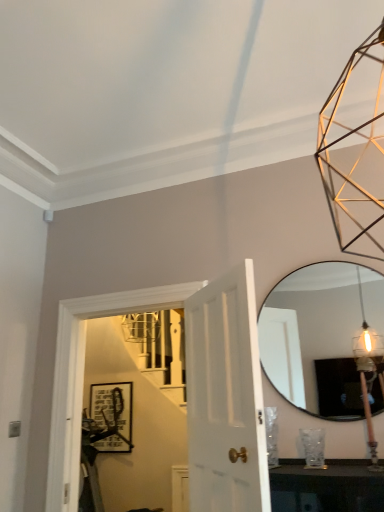
This screenshot has height=512, width=384. What do you see at coordinates (111, 416) in the screenshot? I see `black matte picture frame at center` at bounding box center [111, 416].

The width and height of the screenshot is (384, 512). What are the coordinates of `black matte picture frame at center` in the screenshot? It's located at (111, 416).

Is white glossy door at center to the right of wooden pole at right from the viewer's perspective?

Incorrect, white glossy door at center is not on the right side of wooden pole at right.

Can you confirm if white glossy door at center is taller than wooden pole at right?

Yes, white glossy door at center is taller than wooden pole at right.

Is white glossy door at center with wooden pole at right?

No, white glossy door at center is not in contact with wooden pole at right.

Considering the sizes of objects white glossy door at center and wooden pole at right in the image provided, who is smaller, white glossy door at center or wooden pole at right?

wooden pole at right.

From the image's perspective, between black matte picture frame at center and matte glass mirror at right, which one is located above?

matte glass mirror at right is shown above in the image.

Can you confirm if black matte picture frame at center is taller than matte glass mirror at right?

In fact, black matte picture frame at center may be shorter than matte glass mirror at right.

Measure the distance from black matte picture frame at center to matte glass mirror at right.

black matte picture frame at center is 2.14 meters away from matte glass mirror at right.

Is matte glass mirror at right beside black matte picture frame at center?

matte glass mirror at right and black matte picture frame at center are not in contact.

Considering the points (362, 277) and (127, 401), which point is in front, point (362, 277) or point (127, 401)?

Positioned in front is point (362, 277).

Which object is more forward, matte glass mirror at right or black matte picture frame at center?

matte glass mirror at right is closer to the camera.

Looking at this image, is black matte picture frame at center directly adjacent to wooden pole at right?

black matte picture frame at center and wooden pole at right are clearly separated.

Can you confirm if black matte picture frame at center is positioned to the left of wooden pole at right?

Yes.

Is black matte picture frame at center looking in the opposite direction of wooden pole at right?

No, wooden pole at right is not at the back of black matte picture frame at center.

From the image's perspective, which one is positioned higher, black matte picture frame at center or wooden pole at right?

From the image's view, wooden pole at right is above.

Looking at this image, can you confirm if wooden pole at right is thinner than white glossy door at center?

Yes, wooden pole at right is thinner than white glossy door at center.

Is the depth of wooden pole at right less than that of white glossy door at center?

That is False.

Which object is positioned more to the left, wooden pole at right or white glossy door at center?

Positioned to the left is white glossy door at center.

Is matte glass mirror at right facing away from wooden pole at right?

matte glass mirror at right is not turned away from wooden pole at right.

Which is more to the right, matte glass mirror at right or wooden pole at right?

Positioned to the right is wooden pole at right.

From a real-world perspective, between matte glass mirror at right and wooden pole at right, who is vertically lower?

In real-world perspective, wooden pole at right is lower.

Which is more to the left, white glossy door at center or black matte picture frame at center?

Positioned to the left is black matte picture frame at center.

Identify the location of picture frame lying behind the white glossy door at center. (111, 416).

Considering their positions, is white glossy door at center located in front of or behind black matte picture frame at center?

Visually, white glossy door at center is located in front of black matte picture frame at center.

Is white glossy door at center outside of black matte picture frame at center?

Yes, white glossy door at center is outside of black matte picture frame at center.

I want to click on door in front of the wooden pole at right, so click(x=225, y=397).

This screenshot has height=512, width=384. Find the location of `picture frame on the left side of matte glass mirror at right`. picture frame on the left side of matte glass mirror at right is located at coordinates (111, 416).

Estimate the real-world distances between objects in this image. Which object is further from wooden pole at right, black matte picture frame at center or white glossy door at center?

Among the two, black matte picture frame at center is located further to wooden pole at right.

Which object lies nearer to the anchor point wooden pole at right, matte glass mirror at right or white glossy door at center?

Based on the image, matte glass mirror at right appears to be nearer to wooden pole at right.

Estimate the real-world distances between objects in this image. Which object is further from wooden pole at right, matte glass mirror at right or black matte picture frame at center?

black matte picture frame at center.

Estimate the real-world distances between objects in this image. Which object is closer to black matte picture frame at center, white glossy door at center or wooden pole at right?

The object closer to black matte picture frame at center is wooden pole at right.

Looking at the image, which one is located closer to black matte picture frame at center, white glossy door at center or matte glass mirror at right?

matte glass mirror at right lies closer to black matte picture frame at center than the other object.

Looking at the image, which one is located closer to white glossy door at center, black matte picture frame at center or wooden pole at right?

→ Among the two, wooden pole at right is located nearer to white glossy door at center.

Looking at the image, which one is located further to wooden pole at right, white glossy door at center or matte glass mirror at right?

white glossy door at center is further to wooden pole at right.

Considering their positions, is wooden pole at right positioned closer to black matte picture frame at center than white glossy door at center?

wooden pole at right is closer to black matte picture frame at center.

The height and width of the screenshot is (512, 384). What are the coordinates of `mirror between white glossy door at center and black matte picture frame at center along the z-axis` in the screenshot? It's located at (320, 336).

Locate an element on the screen. The image size is (384, 512). mirror positioned between wooden pole at right and black matte picture frame at center from near to far is located at coordinates (320, 336).

Locate an element on the screen. This screenshot has height=512, width=384. light fixture between white glossy door at center and black matte picture frame at center from front to back is located at coordinates (365, 377).

Find the location of a particular element. mirror situated between white glossy door at center and wooden pole at right from left to right is located at coordinates (320, 336).